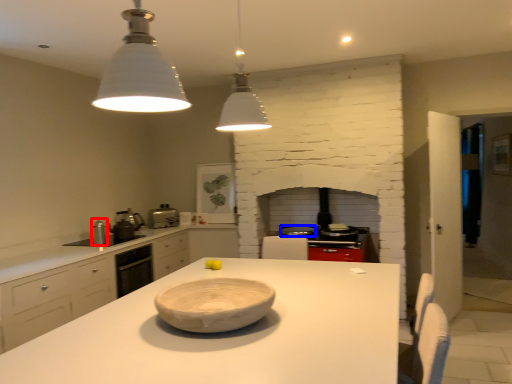
Question: Which point is closer to the camera, appliance (highlighted by a red box) or appliance (highlighted by a blue box)?

Choices:
 (A) appliance
 (B) appliance

Answer: (A)